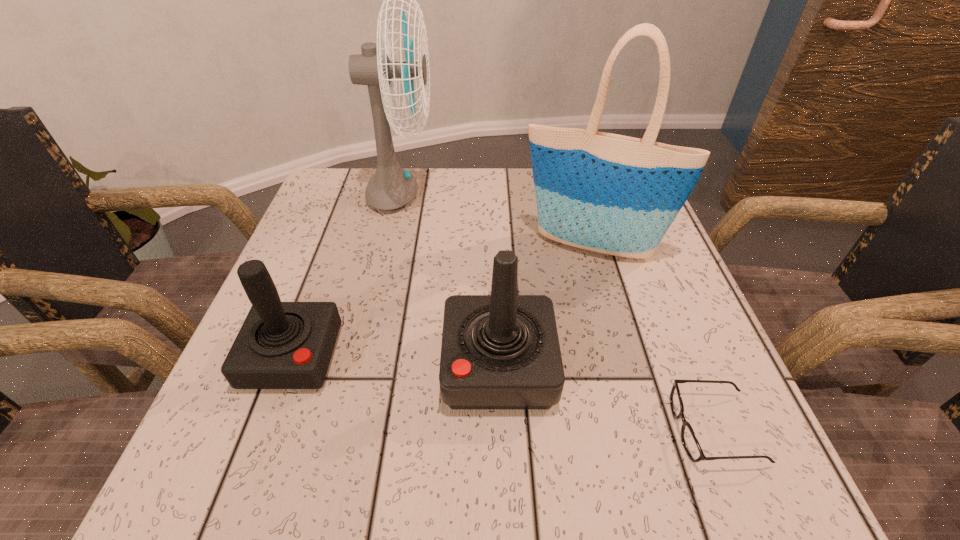
The image size is (960, 540). Identify the location of unoccupied position between the shortest object and the taller joystick. (607, 397).

Find the location of a particular element. The image size is (960, 540). object that is the second closest to the third tallest object is located at coordinates (689, 440).

Where is `object that is the second closest to the fan`? The width and height of the screenshot is (960, 540). object that is the second closest to the fan is located at coordinates (281, 345).

This screenshot has width=960, height=540. I want to click on vacant space that satisfies the following two spatial constraints: 1. on the back side of the tote bag; 2. on the front-facing side of the fan, so click(x=577, y=196).

The width and height of the screenshot is (960, 540). Find the location of `free region that satisfies the following two spatial constraints: 1. on the front-facing side of the tote bag; 2. on the right side of the fan`. free region that satisfies the following two spatial constraints: 1. on the front-facing side of the tote bag; 2. on the right side of the fan is located at coordinates (390, 246).

Image resolution: width=960 pixels, height=540 pixels. Find the location of `vacant space that satisfies the following two spatial constraints: 1. on the front-facing side of the tote bag; 2. on the right side of the fan`. vacant space that satisfies the following two spatial constraints: 1. on the front-facing side of the tote bag; 2. on the right side of the fan is located at coordinates (390, 246).